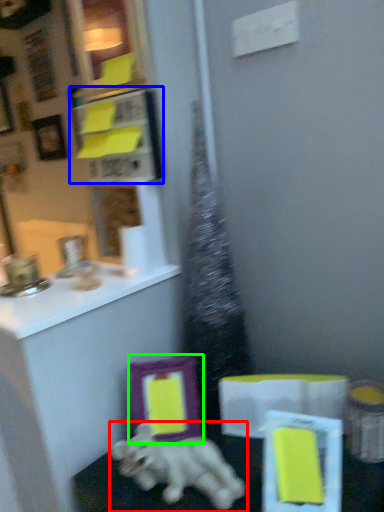
Question: Estimate the real-world distances between objects in this image. Which object is closer to dog (highlighted by a red box), cabinet (highlighted by a blue box) or picture frame (highlighted by a green box)?

Choices:
 (A) cabinet
 (B) picture frame

Answer: (B)